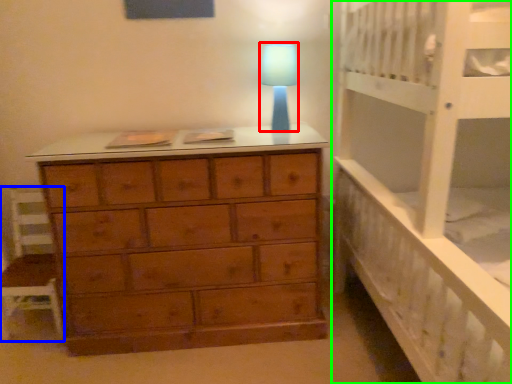
Question: Estimate the real-world distances between objects in this image. Which object is farther from lamp (highlighted by a red box), chair (highlighted by a blue box) or bed (highlighted by a green box)?

Choices:
 (A) chair
 (B) bed

Answer: (A)